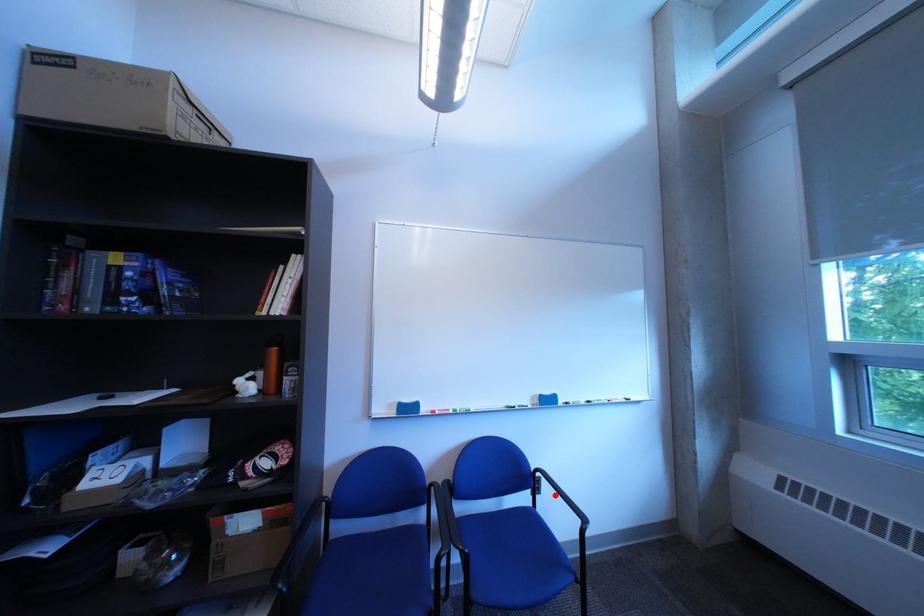
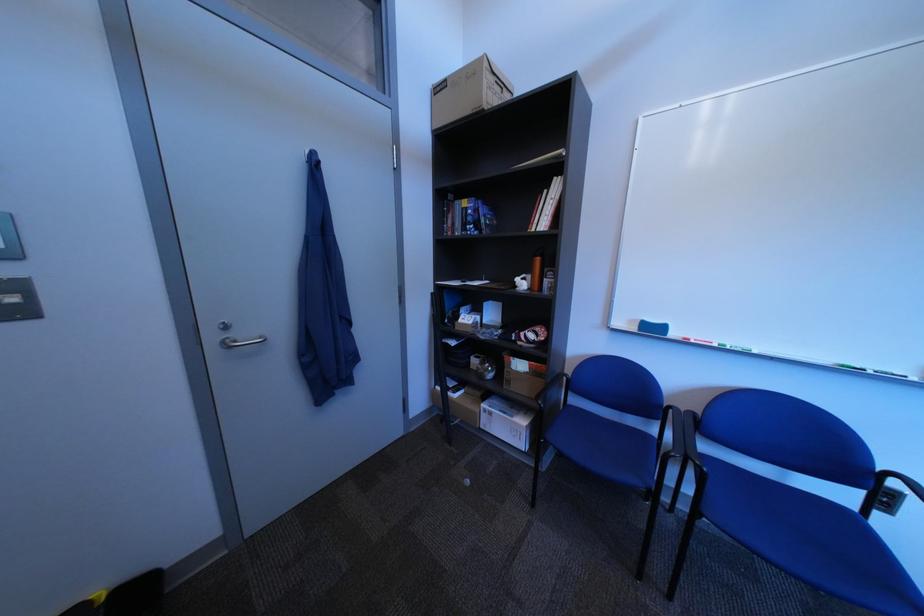
Locate, in the second image, the point that corresponds to the highlighted location in the first image.

(906, 516)